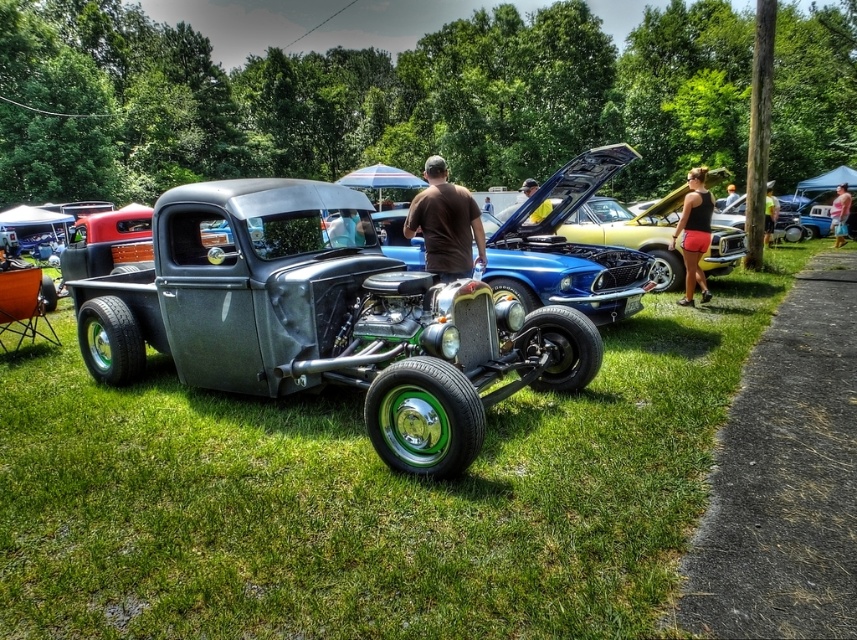
Question: Can you confirm if matte silver pickup truck at center is thinner than brown cotton shirt at center?

Choices:
 (A) yes
 (B) no

Answer: (B)

Question: Among these points, which one is farthest from the camera?

Choices:
 (A) (625, 221)
 (B) (448, 310)

Answer: (A)

Question: Can you confirm if black fabric shorts at right is positioned to the right of matte black shirt at center?

Choices:
 (A) no
 (B) yes

Answer: (B)

Question: Among these points, which one is nearest to the camera?

Choices:
 (A) click(844, 188)
 (B) click(769, 227)
 (C) click(532, 188)

Answer: (C)

Question: Which point is closer to the camera?

Choices:
 (A) black fabric shorts at right
 (B) brown cotton shirt at center

Answer: (B)

Question: Does matte silver pickup truck at center have a greater width compared to pink fabric dress at center?

Choices:
 (A) yes
 (B) no

Answer: (A)